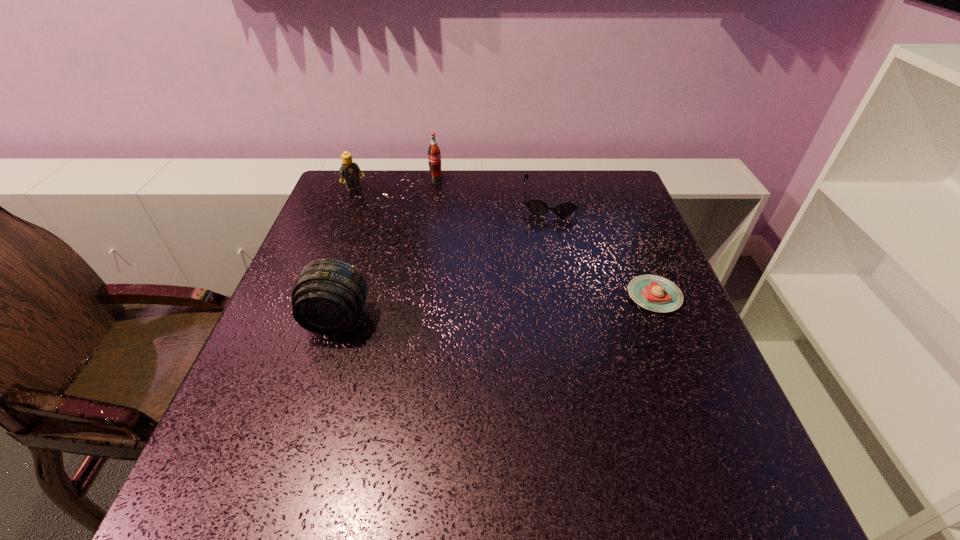
Identify the location of free space located 0.050m in front of the Lego. Image resolution: width=960 pixels, height=540 pixels. (366, 201).

Locate an element on the screen. The height and width of the screenshot is (540, 960). vacant space positioned in front of the Lego is located at coordinates (380, 218).

In order to click on blank area located 0.320m in front of the Lego in this screenshot , I will do `click(408, 251)`.

Find the location of a particular element. vacant space located 0.270m on the lenses of the second object from right to left is located at coordinates (546, 285).

Identify the location of vacant space located on the lenses of the second object from right to left. (550, 231).

Find the location of `vacant space located 0.350m on the lenses of the second object from right to left`. vacant space located 0.350m on the lenses of the second object from right to left is located at coordinates pos(545,310).

What are the coordinates of `vacant region located 0.250m on the label of the third object from left to right` in the screenshot? It's located at (468, 230).

Locate an element on the screen. free region located on the label of the third object from left to right is located at coordinates (x=490, y=261).

This screenshot has width=960, height=540. I want to click on vacant point located 0.120m on the label of the third object from left to right, so click(452, 204).

Find the location of a particular element. The height and width of the screenshot is (540, 960). Lego that is at the far edge is located at coordinates tap(349, 170).